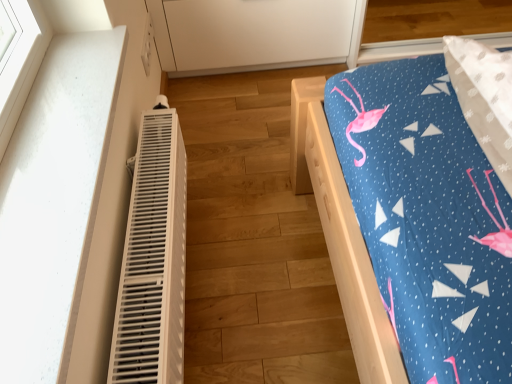
Describe the element at coordinates (416, 209) in the screenshot. This screenshot has width=512, height=384. I see `wooden bed at right` at that location.

Find the location of `white plastic heater at left`. white plastic heater at left is located at coordinates (153, 260).

What is the approximate width of white matte cabinet at upper center?

It is 24.26 inches.

You are a GUI agent. You are given a task and a screenshot of the screen. Output one action in this format:
    pyautogui.click(x=<x>, y=<y>)
    Task: Click on the wooden bed at right
    This screenshot has height=384, width=512.
    Given the screenshot: What is the action you would take?
    pyautogui.click(x=416, y=209)

From a real-world perspective, who is located higher, wooden bed at right or white plastic heater at left?

From a 3D spatial view, white plastic heater at left is above.

Is wooden bed at right inside or outside of white plastic heater at left?

wooden bed at right is outside white plastic heater at left.

Locate an element on the screen. The height and width of the screenshot is (384, 512). heater below the wooden bed at right (from the image's perspective) is located at coordinates (153, 260).

From the image's perspective, would you say wooden bed at right is shown under white plastic heater at left?

Actually, wooden bed at right appears above white plastic heater at left in the image.

Looking at this image, can you confirm if white matte cabinet at upper center is bigger than wooden bed at right?

Correct, white matte cabinet at upper center is larger in size than wooden bed at right.

Is white matte cabinet at upper center with wooden bed at right?

white matte cabinet at upper center and wooden bed at right are not in contact.

From a real-world perspective, is white matte cabinet at upper center above or below wooden bed at right?

Clearly, from a real-world perspective, white matte cabinet at upper center is above wooden bed at right.

Is white matte cabinet at upper center at the left side of wooden bed at right?

Indeed, white matte cabinet at upper center is positioned on the left side of wooden bed at right.

Does white plastic heater at left appear on the right side of wooden bed at right?

Incorrect, white plastic heater at left is not on the right side of wooden bed at right.

From a real-world perspective, is white plastic heater at left above or below wooden bed at right?

From a real-world perspective, white plastic heater at left is physically above wooden bed at right.

Is white plastic heater at left looking in the opposite direction of wooden bed at right?

That's not correct — white plastic heater at left is not looking away from wooden bed at right.

Is white plastic heater at left thinner than wooden bed at right?

Correct, the width of white plastic heater at left is less than that of wooden bed at right.

Between white plastic heater at left and white matte cabinet at upper center, which one has more height?

white matte cabinet at upper center is taller.

In the scene shown: In terms of width, does white plastic heater at left look wider or thinner when compared to white matte cabinet at upper center?

In the image, white plastic heater at left appears to be more narrow than white matte cabinet at upper center.

Is point (160, 276) closer or farther from the camera than point (243, 51)?

Clearly, point (160, 276) is closer to the camera than point (243, 51).

Looking at this image, between white plastic heater at left and white matte cabinet at upper center, which one appears on the left side from the viewer's perspective?

white plastic heater at left.

Can you confirm if white matte cabinet at upper center is taller than white plastic heater at left?

Indeed, white matte cabinet at upper center has a greater height compared to white plastic heater at left.

Can you confirm if white matte cabinet at upper center is positioned to the left of white plastic heater at left?

No, white matte cabinet at upper center is not to the left of white plastic heater at left.

How different are the orientations of white matte cabinet at upper center and white plastic heater at left in degrees?

white matte cabinet at upper center and white plastic heater at left are facing 89.7 degrees away from each other.

Can you see white matte cabinet at upper center touching white plastic heater at left?

white matte cabinet at upper center and white plastic heater at left are clearly separated.

From the image's perspective, is wooden bed at right on white matte cabinet at upper center?

No, from the image's perspective, wooden bed at right is not above white matte cabinet at upper center.

From a real-world perspective, relative to white matte cabinet at upper center, is wooden bed at right vertically above or below?

wooden bed at right is situated lower than white matte cabinet at upper center in the real world.

Consider the image. Would you say white matte cabinet at upper center is part of wooden bed at right's contents?

That's incorrect, white matte cabinet at upper center is not inside wooden bed at right.

The width and height of the screenshot is (512, 384). Find the location of `heater that is above the wooden bed at right (from a real-world perspective)`. heater that is above the wooden bed at right (from a real-world perspective) is located at coordinates (153, 260).

You are a GUI agent. You are given a task and a screenshot of the screen. Output one action in this format:
    pyautogui.click(x=<x>, y=<y>)
    Task: Click on the cabinetry located behind the wooden bed at right
    
    Given the screenshot: What is the action you would take?
    pyautogui.click(x=254, y=34)

In the scene shown: Based on their spatial positions, is white matte cabinet at upper center or wooden bed at right closer to white plastic heater at left?

The object closer to white plastic heater at left is wooden bed at right.

Looking at this image, based on their spatial positions, is white matte cabinet at upper center or white plastic heater at left closer to wooden bed at right?

white plastic heater at left is closer to wooden bed at right.

Based on their spatial positions, is white plastic heater at left or white matte cabinet at upper center closer to wooden bed at right?

white plastic heater at left lies closer to wooden bed at right than the other object.

Which object lies further to the anchor point white matte cabinet at upper center, wooden bed at right or white plastic heater at left?

Among the two, wooden bed at right is located further to white matte cabinet at upper center.

Estimate the real-world distances between objects in this image. Which object is further from white plastic heater at left, wooden bed at right or white matte cabinet at upper center?

white matte cabinet at upper center is further to white plastic heater at left.

Which object lies further to the anchor point white matte cabinet at upper center, white plastic heater at left or wooden bed at right?

wooden bed at right lies further to white matte cabinet at upper center than the other object.

The image size is (512, 384). I want to click on furniture that lies between white matte cabinet at upper center and white plastic heater at left from top to bottom, so click(416, 209).